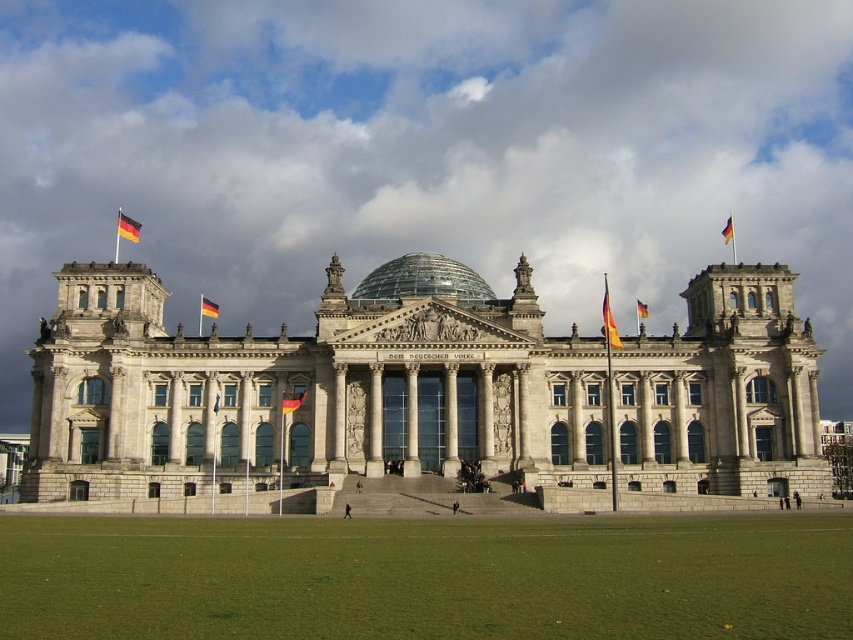
Question: Is german flag at upper left behind yellowmaterial/textureflag at upper left?

Choices:
 (A) no
 (B) yes

Answer: (B)

Question: Which point is closer to the camera taking this photo?

Choices:
 (A) (627, 387)
 (B) (289, 397)

Answer: (B)

Question: Which point is closer to the camera?

Choices:
 (A) matte yellow flag at center
 (B) german flag at upper left
 (C) yellow and red fabric flag at center

Answer: (A)

Question: Is transparent glass dome at center to the right of yellowmaterial/textureflag at upper left from the viewer's perspective?

Choices:
 (A) yes
 (B) no

Answer: (A)

Question: Which point appears closest to the camera in this image?

Choices:
 (A) (732, 230)
 (B) (294, 401)

Answer: (B)

Question: Is green grass at lower center to the right of yellow and red striped fabric at upper center from the viewer's perspective?

Choices:
 (A) yes
 (B) no

Answer: (B)